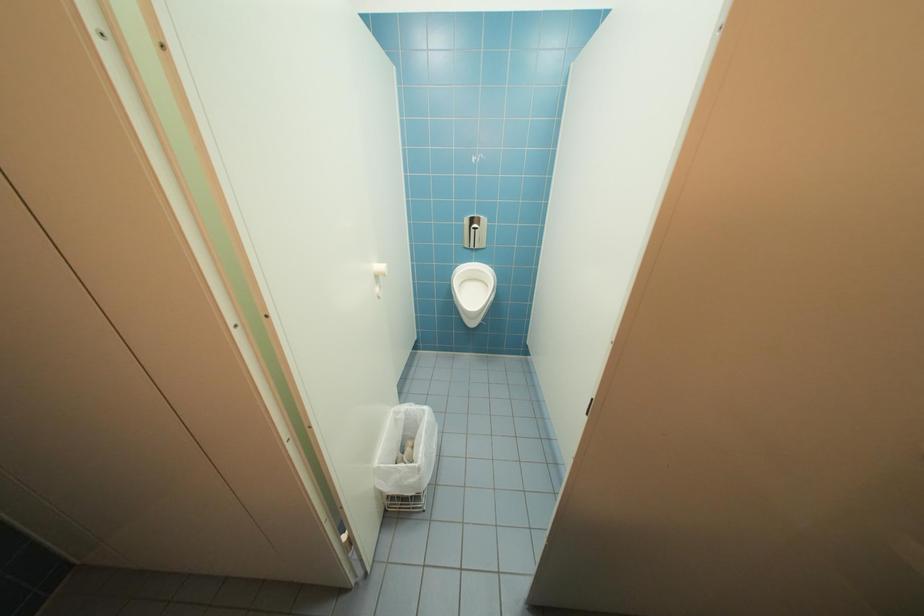
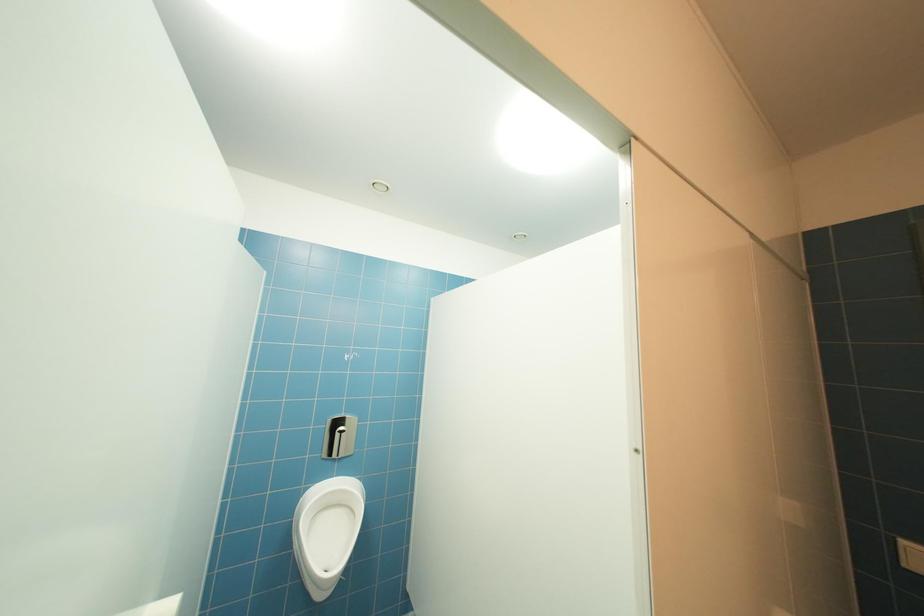
Based on the continuous images, in which direction is the camera rotating?

The camera rotated toward right-up.